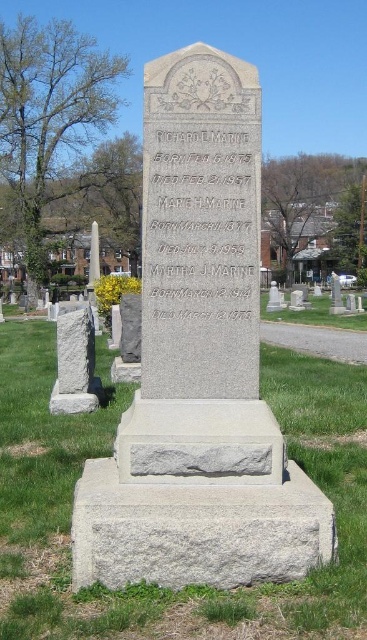
You are standing in a cemetery and see the green grass at center and the gray stone marker at left. Which of these two objects takes up more space in the image?

The green grass at center takes up more space in the image because it has a larger size compared to the gray stone marker at left.

You are standing in a cemetery and see the green grass at center and the gray stone marker at left. Which object is closer to you?

The green grass at center is closer to you because it is in front of the gray stone marker at left.